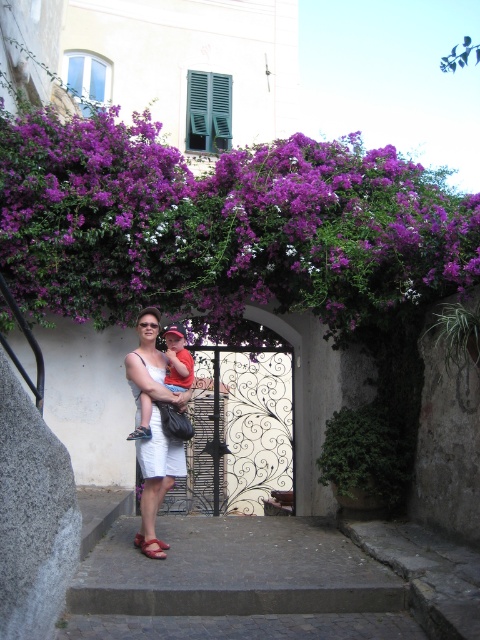
Does white cotton shorts at center come in front of matte brown sandal at lower center?

No, it is not.

Is white cotton shorts at center to the left of matte brown sandal at lower center from the viewer's perspective?

A: Yes, white cotton shorts at center is to the left of matte brown sandal at lower center.

Locate an element on the screen. white cotton shorts at center is located at coordinates (154, 420).

Does white cotton shorts at center appear on the right side of matte red shirt at center?

Incorrect, white cotton shorts at center is not on the right side of matte red shirt at center.

Measure the distance between white cotton shorts at center and matte red shirt at center.

A distance of 5.60 inches exists between white cotton shorts at center and matte red shirt at center.

Locate an element on the screen. The height and width of the screenshot is (640, 480). white cotton shorts at center is located at coordinates (154, 420).

Between purple matte flowers at upper center and matte brown sandal at lower center, which one has less height?

matte brown sandal at lower center is shorter.

Is point (29, 305) closer to camera compared to point (144, 550)?

No, (29, 305) is further to viewer.

Locate an element on the screen. The image size is (480, 640). purple matte flowers at upper center is located at coordinates (226, 227).